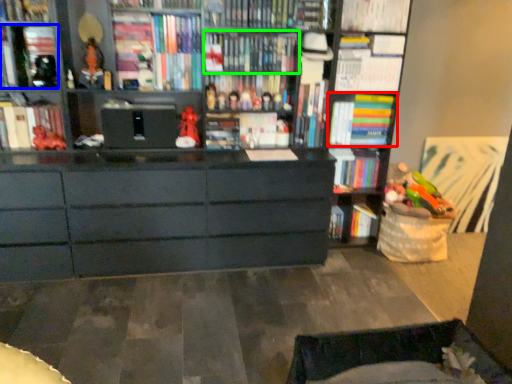
Question: Estimate the real-world distances between objects in this image. Which object is farther from book (highlighted by a red box), book (highlighted by a blue box) or book (highlighted by a green box)?

Choices:
 (A) book
 (B) book

Answer: (A)